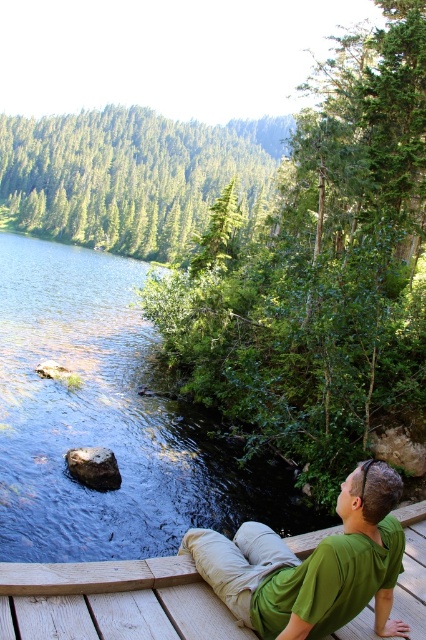
Which is above, clear water at lower left or green matte shirt at lower right?

clear water at lower left is above.

Where is `clear water at lower left`? clear water at lower left is located at coordinates (108, 420).

Image resolution: width=426 pixels, height=640 pixels. In order to click on clear water at lower left in this screenshot , I will do `click(108, 420)`.

Find the location of `clear water at lower left`. clear water at lower left is located at coordinates (108, 420).

Does clear water at lower left lie behind wooden deck at lower center?

Yes, clear water at lower left is further from the viewer.

Between clear water at lower left and wooden deck at lower center, which one has less height?

With less height is wooden deck at lower center.

Is point (147, 435) less distant than point (175, 580)?

No, it is behind (175, 580).

Where is `clear water at lower left`? Image resolution: width=426 pixels, height=640 pixels. clear water at lower left is located at coordinates (108, 420).

This screenshot has height=640, width=426. What do you see at coordinates (311, 564) in the screenshot?
I see `green matte shirt at lower right` at bounding box center [311, 564].

Locate an element on the screen. The height and width of the screenshot is (640, 426). green matte shirt at lower right is located at coordinates (311, 564).